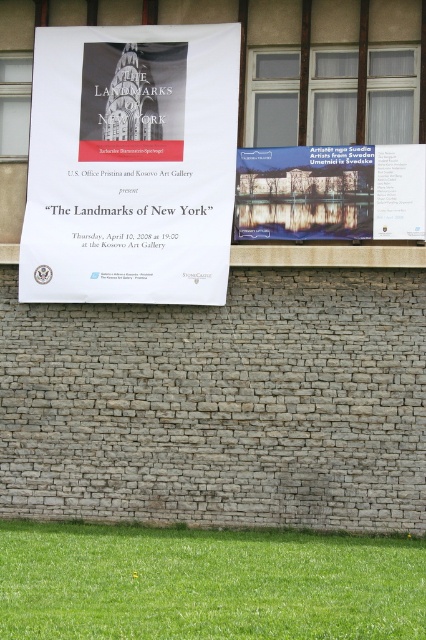
Is the position of white paper poster at upper center less distant than that of green grass at lower center?

No, it is behind green grass at lower center.

Who is higher up, white paper poster at upper center or green grass at lower center?

white paper poster at upper center

Where is `white paper poster at upper center`? The image size is (426, 640). white paper poster at upper center is located at coordinates (131, 164).

Is green grass at lower center behind matte paper poster at center?

No, it is not.

Is point (322, 540) behind point (319, 221)?

No, it is not.

Is point (394, 598) positioned in front of point (238, 188)?

Yes, point (394, 598) is in front of point (238, 188).

Where is `green grass at lower center`? This screenshot has width=426, height=640. green grass at lower center is located at coordinates (207, 582).

Is white paper poster at upper center to the right of matte paper poster at center from the viewer's perspective?

No, white paper poster at upper center is not to the right of matte paper poster at center.

Locate an element on the screen. The width and height of the screenshot is (426, 640). white paper poster at upper center is located at coordinates coord(131,164).

Find the location of a particular element. white paper poster at upper center is located at coordinates (131, 164).

In order to click on white paper poster at upper center in this screenshot , I will do `click(131, 164)`.